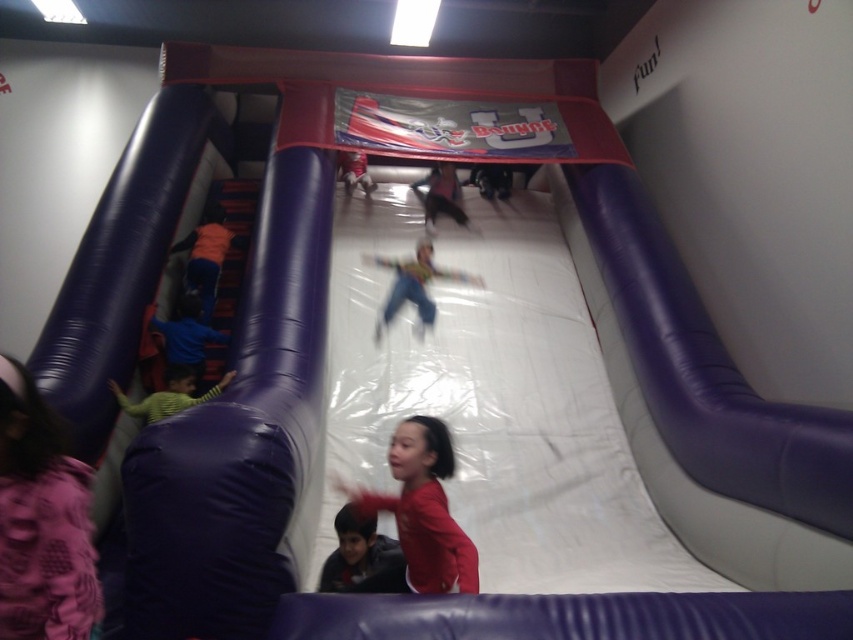
You are a safety inspector checking the inflatable slide. You need to ensure that the dark blue fabric child at lower center and the green striped shirt at left are not blocking the emergency exit located at the lower right corner. Which child is more likely to fit through the narrow exit without difficulty?

The dark blue fabric child at lower center is thinner than the green striped shirt at left, so they are more likely to fit through the narrow exit without difficulty.

You are a parent looking for your child in the bouncy castle area. You see the matte purple dress at lower left and the blue fabric child at left. Which one is closer to the bottom of the slide?

The matte purple dress at lower left is closer to the bottom of the slide because it is positioned below the blue fabric child at left.

Consider the image. You are a parent trying to locate your child wearing orange fabric pants at left in the bouncy castle area. Based on the coordinates provided, where would you find them relative to the main entrance of the inflatable structure?

The orange fabric pants at left are located at coordinates point (206, 257), which places them at the lower left area of the inflatable structure, likely near the entrance or exit area.